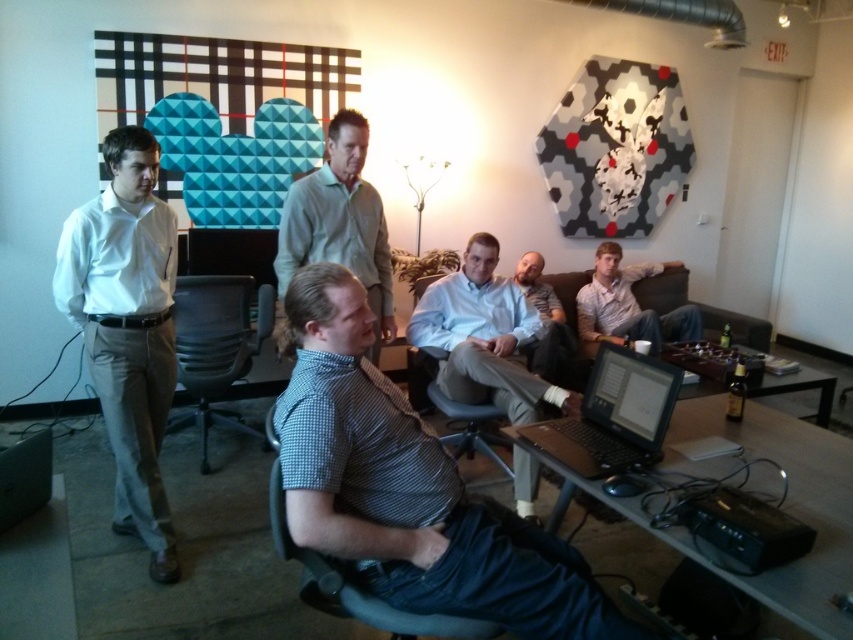
Who is lower down, checkered shirt at center or light blue shirt at center?

light blue shirt at center is lower down.

Is point (480, 260) in front of point (521, 278)?

Yes, point (480, 260) is closer to viewer.

This screenshot has width=853, height=640. I want to click on checkered shirt at center, so click(x=485, y=337).

Where is `checkered shirt at center`? The width and height of the screenshot is (853, 640). checkered shirt at center is located at coordinates (485, 337).

Does white smooth shirt at left have a lesser width compared to light blue shirt at center?

Incorrect, white smooth shirt at left's width is not less than light blue shirt at center's.

Is white smooth shirt at left shorter than light blue shirt at center?

No.

Between point (125, 227) and point (554, 365), which one is positioned in front?

Point (125, 227) is in front.

Identify the location of white smooth shirt at left. (126, 328).

Is checkered shirt at center to the left of light brown shirt at center from the viewer's perspective?

Indeed, checkered shirt at center is positioned on the left side of light brown shirt at center.

Identify the location of checkered shirt at center. (485, 337).

Locate an element on the screen. The height and width of the screenshot is (640, 853). checkered shirt at center is located at coordinates (485, 337).

Where is `checkered shirt at center`? Image resolution: width=853 pixels, height=640 pixels. checkered shirt at center is located at coordinates (485, 337).